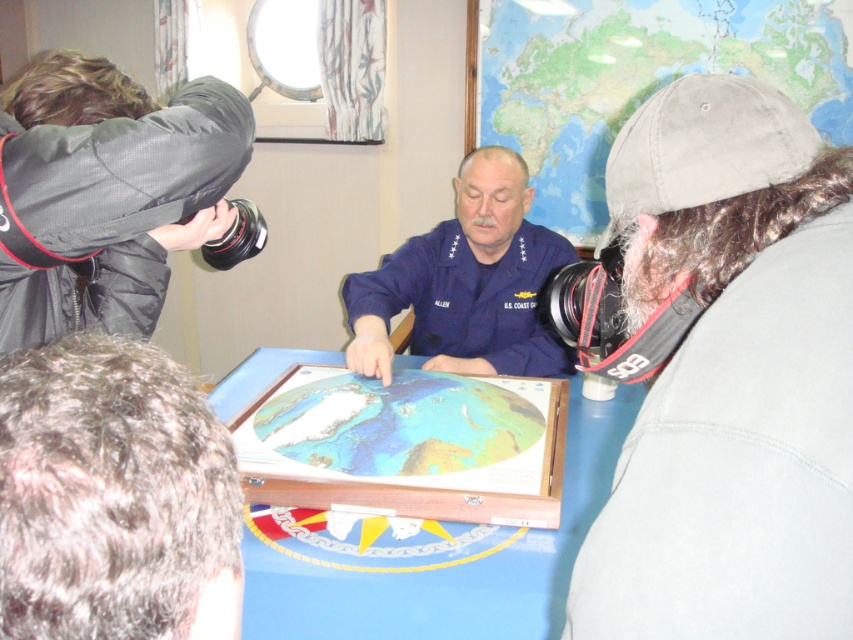
You are organizing a photography session and need to place a gray fabric cap at upper right and a wooden map case at center on a shelf. The shelf has limited space. Based on the scene description, which object will require more space horizontally?

The wooden map case at center requires more horizontal space because its width is greater than the gray fabric cap at upper right.

You are standing in the room and want to take a photo of the two points mentioned. Which point, point (773, 536) or point (485, 600), appears closer to you?

Point (773, 536) is closer to the viewer than point (485, 600).